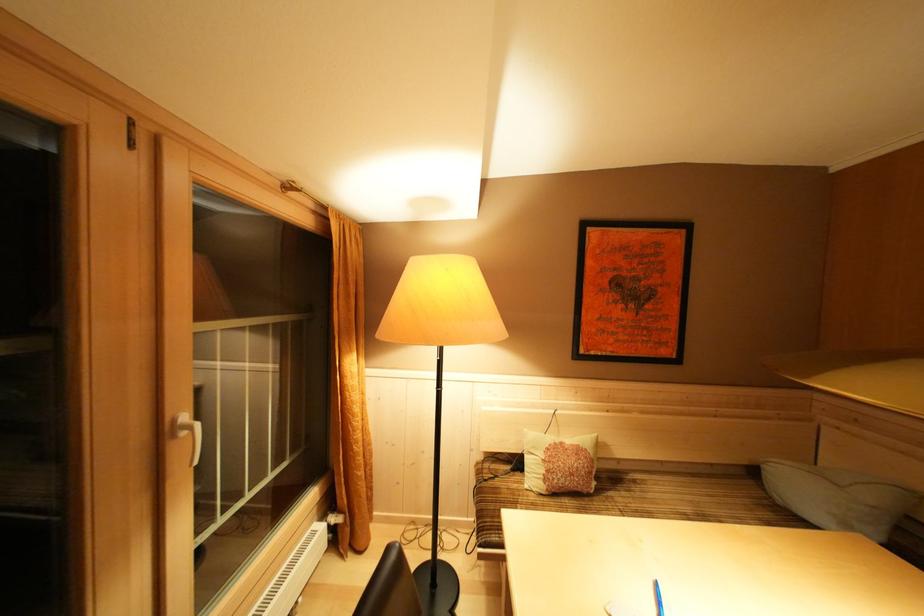
The width and height of the screenshot is (924, 616). What do you see at coordinates (440, 369) in the screenshot?
I see `the black floor lamp` at bounding box center [440, 369].